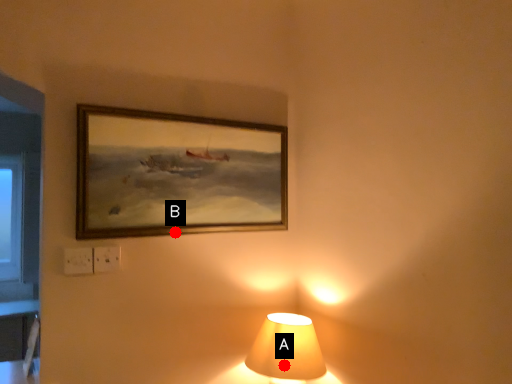
Question: Two points are circled on the image, labeled by A and B beside each circle. Among these points, which one is farthest from the camera?

Choices:
 (A) A is further
 (B) B is further

Answer: (B)